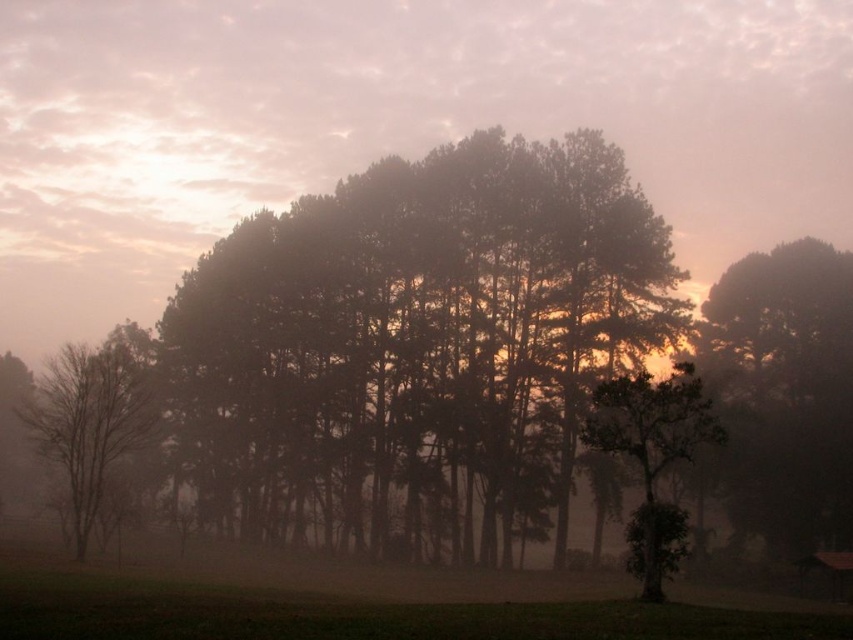
Who is lower down, dark green foliage at center or green leafy tree at center?

Positioned lower is green leafy tree at center.

Image resolution: width=853 pixels, height=640 pixels. In order to click on dark green foliage at center in this screenshot , I will do `click(418, 342)`.

Is dark green textured tree at right positioned before green leafy tree at center?

No.

Is dark green textured tree at right above green leafy tree at center?

Yes.

Where is `dark green textured tree at right`? dark green textured tree at right is located at coordinates (784, 394).

How distant is dark green textured tree at right from bare wood tree at left?

dark green textured tree at right is 33.08 meters from bare wood tree at left.

Who is taller, dark green textured tree at right or bare wood tree at left?

dark green textured tree at right is taller.

Measure the distance between point (x=776, y=257) and camera.

67.34 meters

At what (x,y) coordinates should I click in order to perform the action: click on dark green textured tree at right. Please return your answer as a coordinate pair (x, y). The image size is (853, 640). Looking at the image, I should click on (784, 394).